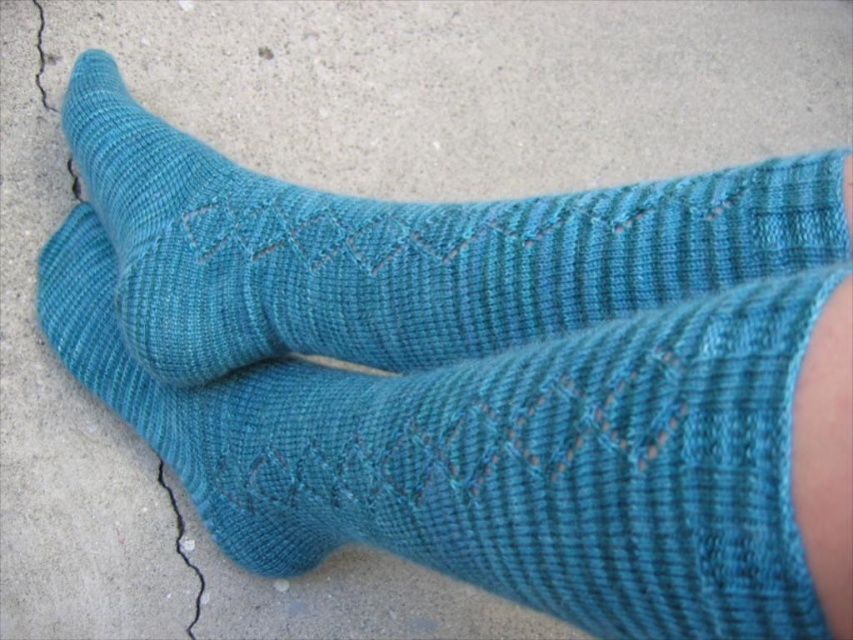
Can you confirm if teal knitted socks at center is taller than teal knitted sock at center?

Correct, teal knitted socks at center is much taller as teal knitted sock at center.

Is teal knitted socks at center closer to the viewer compared to teal knitted sock at center?

That is True.

This screenshot has width=853, height=640. Identify the location of teal knitted socks at center. (489, 410).